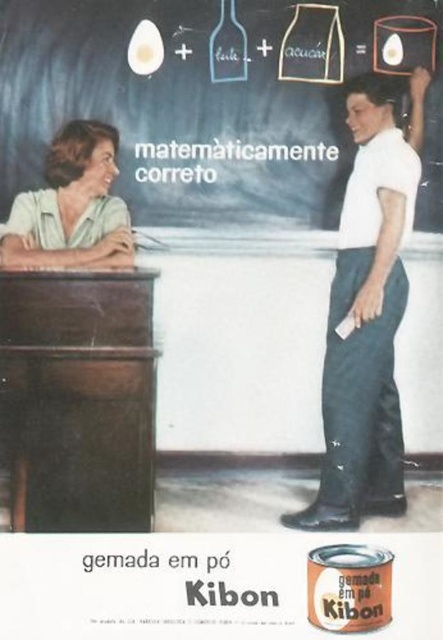
Question: Which point is farther to the camera?

Choices:
 (A) matte glass bottle at upper center
 (B) white smooth shirt at center
 (C) matte green blouse at upper left

Answer: (C)

Question: Which of the following is the farthest from the observer?

Choices:
 (A) white smooth shirt at center
 (B) chalkboard at upper center

Answer: (A)

Question: Does chalkboard at upper center appear over matte glass bottle at upper center?

Choices:
 (A) yes
 (B) no

Answer: (B)

Question: Does matte green blouse at upper left appear on the left side of matte glass bottle at upper center?

Choices:
 (A) no
 (B) yes

Answer: (B)

Question: Considering the real-world distances, which object is closest to the matte glass bottle at upper center?

Choices:
 (A) white smooth shirt at center
 (B) matte green blouse at upper left
 (C) chalkboard at upper center

Answer: (C)

Question: Does chalkboard at upper center appear over matte glass bottle at upper center?

Choices:
 (A) yes
 (B) no

Answer: (B)